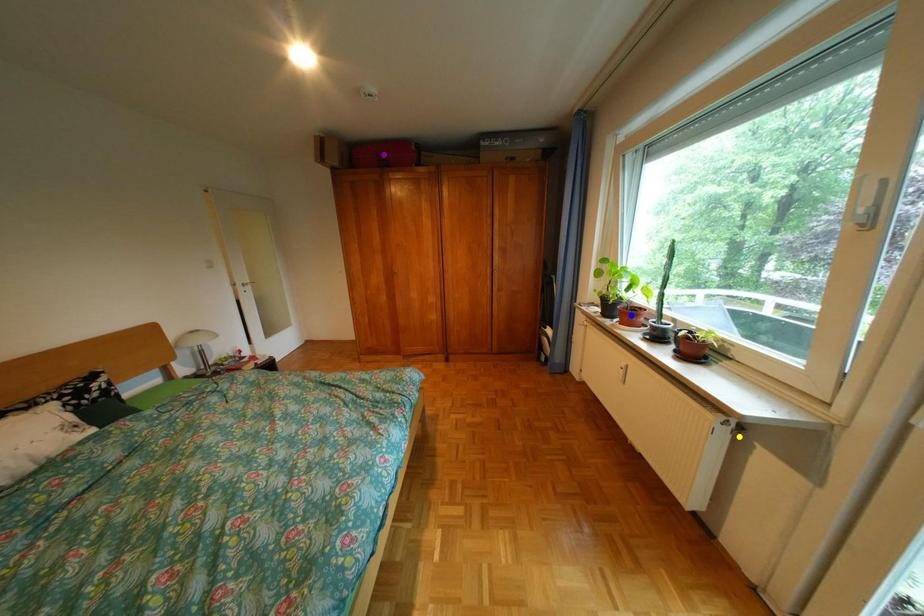
Order these from nearest to farthest:
A) purple point
B) blue point
C) yellow point

yellow point < blue point < purple point